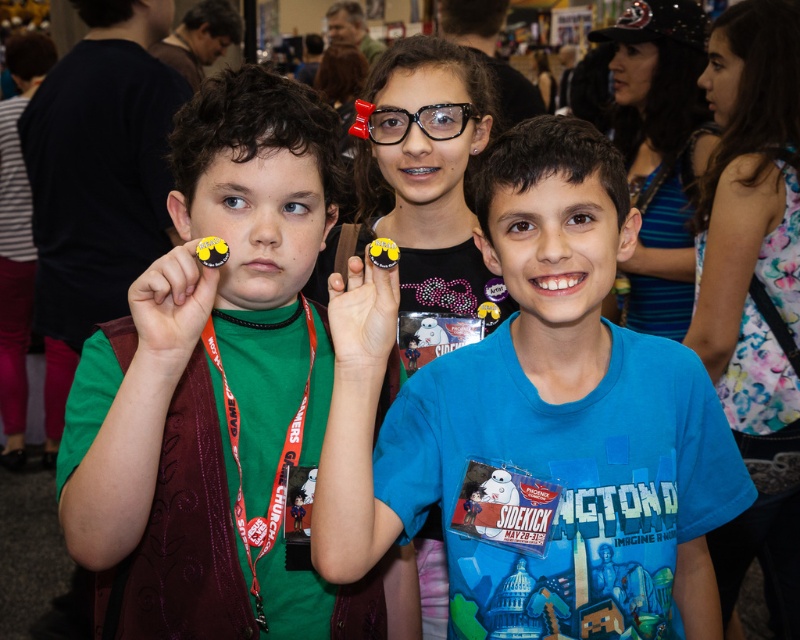
You are a photographer at the event and need to adjust the lighting so that the red fabric lanyard at center and the clear plastic glasses at center are both visible. Since the lanyard is red and the glasses are clear, which object might need more light to be seen properly?

The clear plastic glasses at center might need more light because clear objects often require additional illumination to be visible, while the red fabric lanyard at center has color and texture that reflect light more effectively.